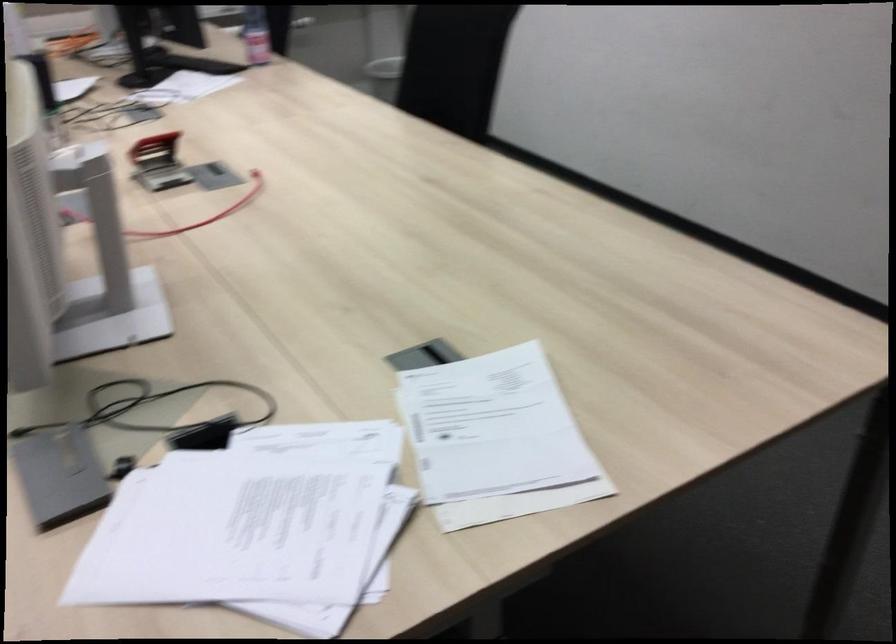
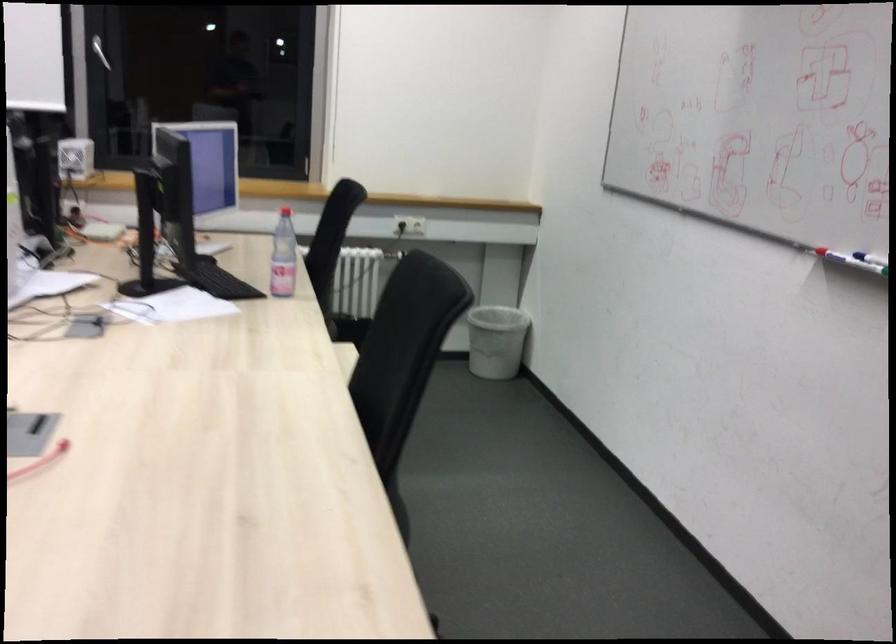
Question: The first image is from the beginning of the video and the second image is from the end. How did the camera likely rotate when shooting the video?

Choices:
 (A) Left
 (B) Right
 (C) Up
 (D) Down

Answer: (A)